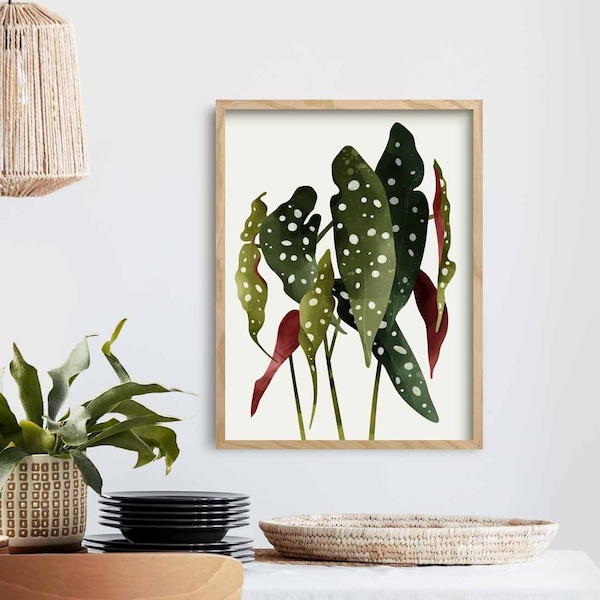
Where is `bowls`? bowls is located at coordinates (186, 534).